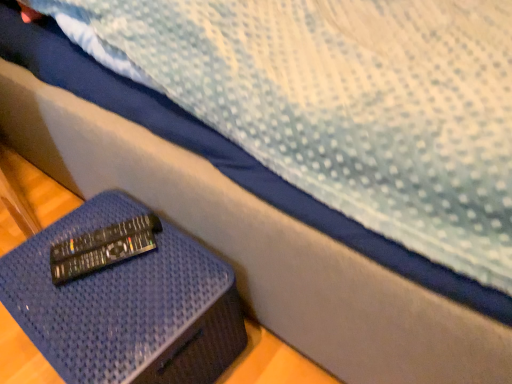
Where is `free location in front of black plastic remote at lower left, the second remote viewed from the back`? The width and height of the screenshot is (512, 384). free location in front of black plastic remote at lower left, the second remote viewed from the back is located at coordinates (102, 318).